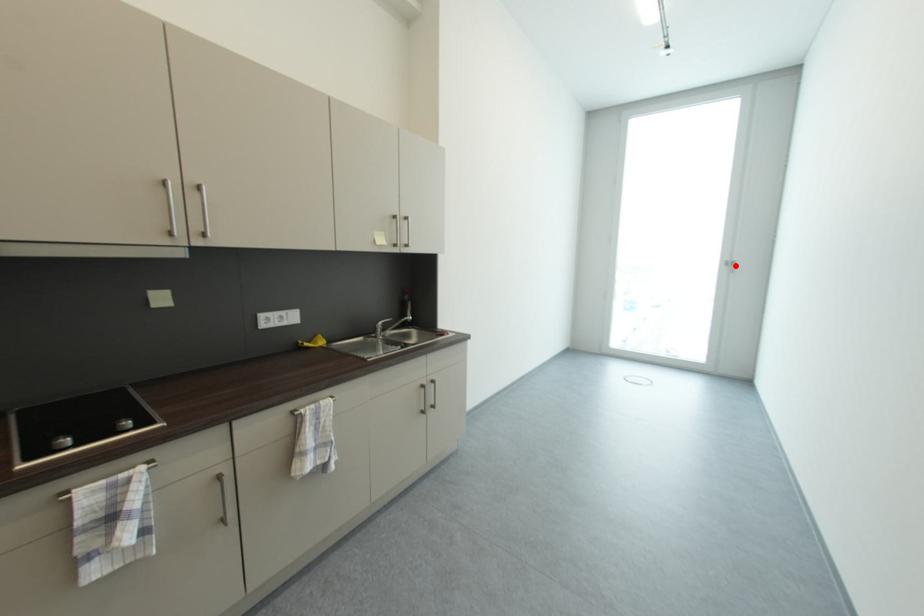
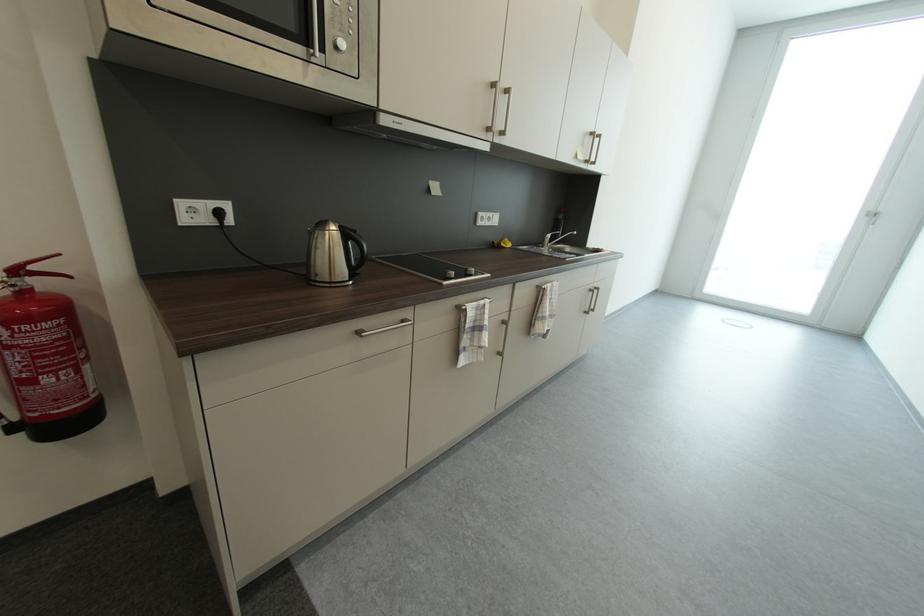
The point at the highlighted location is marked in the first image. Where is the corresponding point in the second image?

(878, 217)